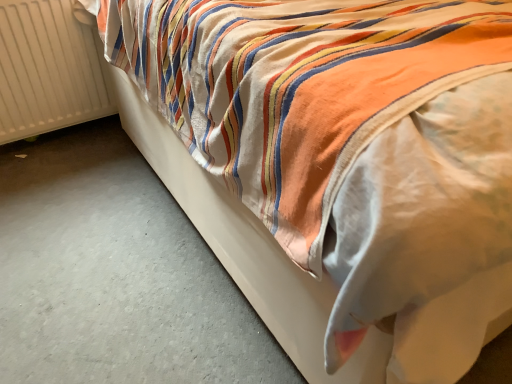
Question: From a real-world perspective, relative to white smooth concrete at lower left, is white ribbed radiator at left vertically above or below?

Choices:
 (A) above
 (B) below

Answer: (A)

Question: From the image's perspective, relative to white smooth concrete at lower left, is white ribbed radiator at left above or below?

Choices:
 (A) below
 (B) above

Answer: (B)

Question: Relative to white smooth concrete at lower left, is white ribbed radiator at left in front or behind?

Choices:
 (A) front
 (B) behind

Answer: (B)

Question: In terms of width, does white smooth concrete at lower left look wider or thinner when compared to white ribbed radiator at left?

Choices:
 (A) thin
 (B) wide

Answer: (B)

Question: In the image, is white smooth concrete at lower left positioned in front of or behind white ribbed radiator at left?

Choices:
 (A) behind
 (B) front

Answer: (B)

Question: Is white smooth concrete at lower left spatially inside white ribbed radiator at left, or outside of it?

Choices:
 (A) outside
 (B) inside

Answer: (A)

Question: From the image's perspective, relative to white ribbed radiator at left, is white smooth concrete at lower left above or below?

Choices:
 (A) above
 (B) below

Answer: (B)